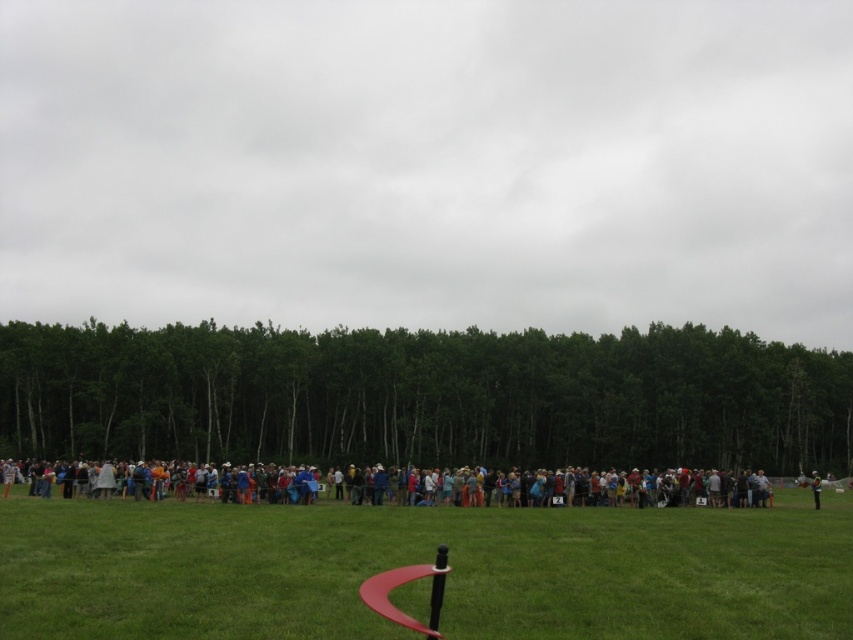
Which is below, multicolored clothing at center or reflective silver helmet at lower right?

reflective silver helmet at lower right is below.

Who is taller, multicolored clothing at center or reflective silver helmet at lower right?

multicolored clothing at center is taller.

Is point (477, 490) closer to camera compared to point (816, 492)?

Yes, it is in front of point (816, 492).

You are a GUI agent. You are given a task and a screenshot of the screen. Output one action in this format:
    pyautogui.click(x=<x>, y=<y>)
    Task: Click on the multicolored clothing at center
    The width and height of the screenshot is (853, 640).
    Given the screenshot: What is the action you would take?
    pyautogui.click(x=677, y=490)

Is green grass at center above multicolored clothing at center?

Indeed, green grass at center is positioned over multicolored clothing at center.

Does green grass at center have a larger size compared to multicolored clothing at center?

Incorrect, green grass at center is not larger than multicolored clothing at center.

Where is `green grass at center`? green grass at center is located at coordinates (x=426, y=563).

Is point (331, 417) more distant than point (242, 534)?

Yes.

Which is above, green leafy trees at center or green grass at center?

Positioned higher is green leafy trees at center.

The image size is (853, 640). In order to click on green leafy trees at center in this screenshot , I will do `click(424, 396)`.

I want to click on green leafy trees at center, so click(x=424, y=396).